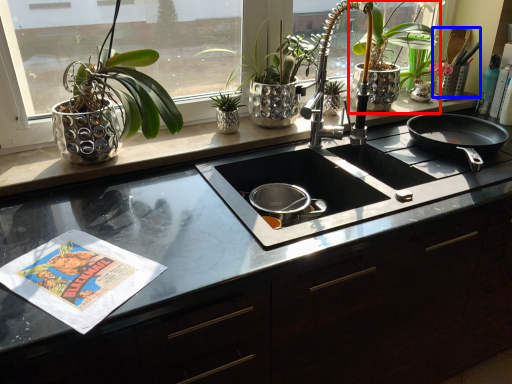
Question: Which object is further to the camera taking this photo, houseplant (highlighted by a red box) or appliance (highlighted by a blue box)?

Choices:
 (A) houseplant
 (B) appliance

Answer: (B)